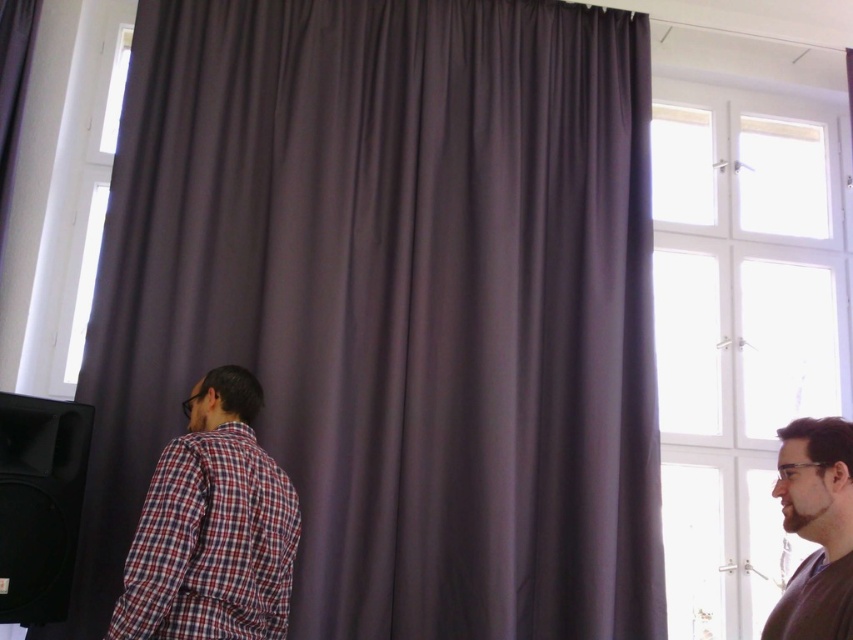
Which of these two, purple matte curtain at center or brown matte shirt at right, stands shorter?

With less height is brown matte shirt at right.

Who is taller, purple matte curtain at center or brown matte shirt at right?

purple matte curtain at center

Is point (502, 570) more distant than point (828, 554)?

Yes, it is.

Where is `purple matte curtain at center`? The width and height of the screenshot is (853, 640). purple matte curtain at center is located at coordinates (393, 305).

Does purple matte curtain at center appear on the right side of plaid fabric shirt at left?

Correct, you'll find purple matte curtain at center to the right of plaid fabric shirt at left.

Is the position of purple matte curtain at center less distant than that of plaid fabric shirt at left?

No, purple matte curtain at center is further to the viewer.

Find the location of a particular element. This screenshot has height=640, width=853. purple matte curtain at center is located at coordinates (393, 305).

Between plaid fabric shirt at left and brown matte shirt at right, which one is positioned lower?

plaid fabric shirt at left

Who is more forward, (183, 406) or (836, 620)?

Point (836, 620) is in front.

Is point (216, 595) more distant than point (795, 500)?

Yes, point (216, 595) is behind point (795, 500).

The width and height of the screenshot is (853, 640). I want to click on plaid fabric shirt at left, so click(212, 528).